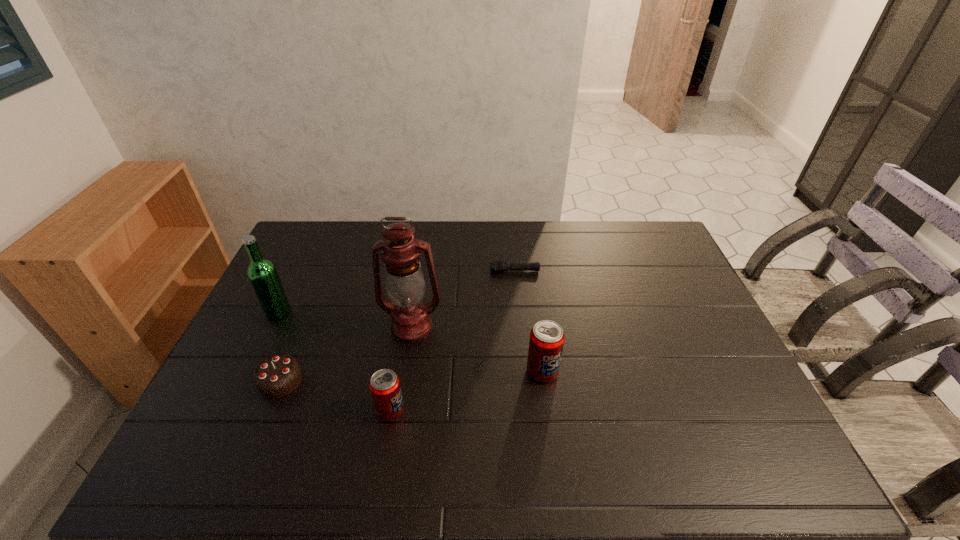
Where is `free location located 0.140m on the right of the taller soda can`? Image resolution: width=960 pixels, height=540 pixels. free location located 0.140m on the right of the taller soda can is located at coordinates (610, 372).

The height and width of the screenshot is (540, 960). I want to click on free space located at the lens end of the farthest object, so click(408, 271).

In order to click on vacant space located 0.250m at the lens end of the farthest object in this screenshot , I will do `click(417, 271)`.

Locate an element on the screen. free space located at the lens end of the farthest object is located at coordinates (432, 271).

Where is `free space located 0.300m on the right of the chocolate cake`? The width and height of the screenshot is (960, 540). free space located 0.300m on the right of the chocolate cake is located at coordinates (415, 381).

Locate an element on the screen. free space located on the back of the beer bottle is located at coordinates (289, 291).

The image size is (960, 540). Find the location of `vacant region located 0.100m on the left of the oil lamp`. vacant region located 0.100m on the left of the oil lamp is located at coordinates pyautogui.click(x=348, y=327).

Identify the location of object present at the near edge. The height and width of the screenshot is (540, 960). (384, 385).

At what (x,y) coordinates should I click in order to perform the action: click on chocolate cake located at the left edge. Please return your answer as a coordinate pair (x, y). Looking at the image, I should click on tap(278, 375).

Find the location of a particular element. This screenshot has width=960, height=540. beer bottle at the left edge is located at coordinates (263, 276).